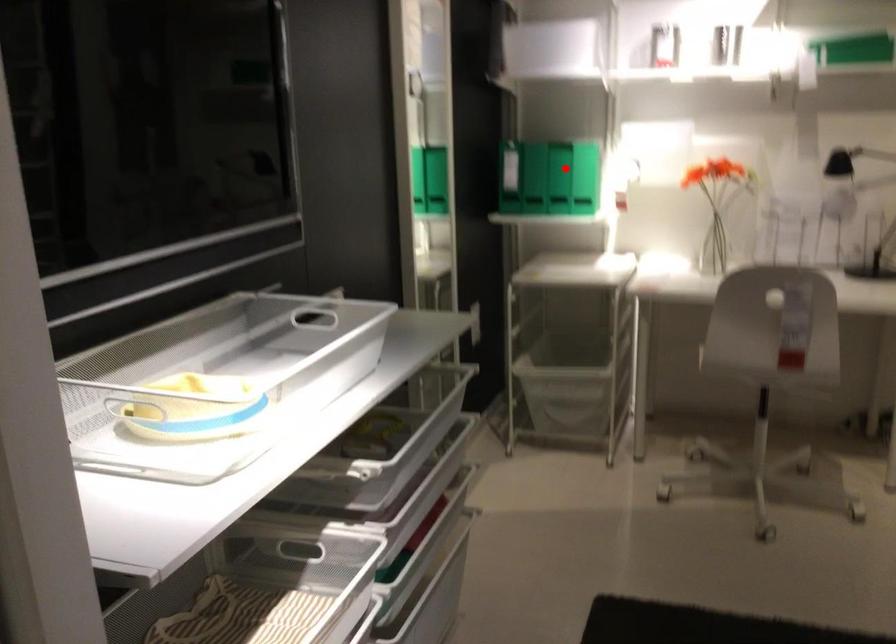
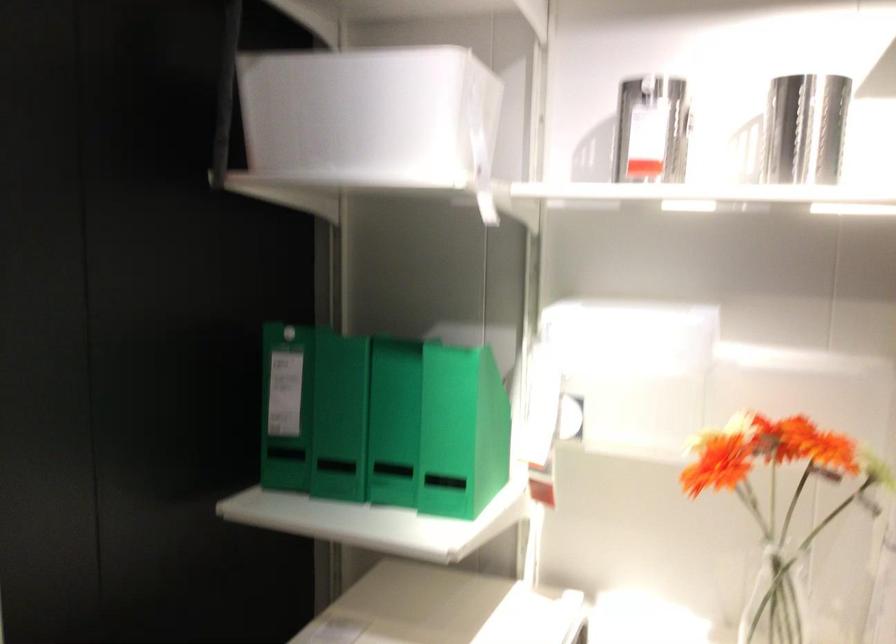
The point at the highlighted location is marked in the first image. Where is the corresponding point in the second image?

(392, 422)